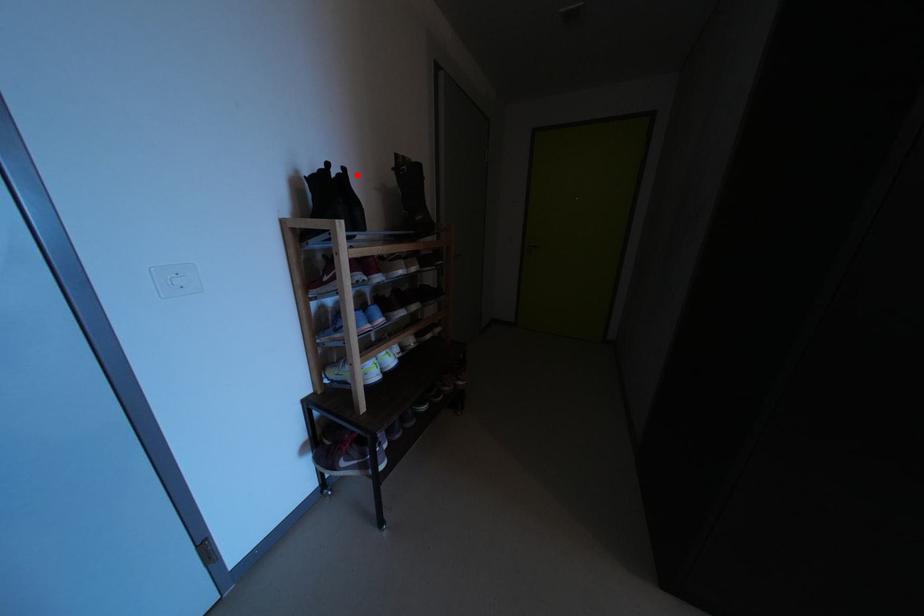
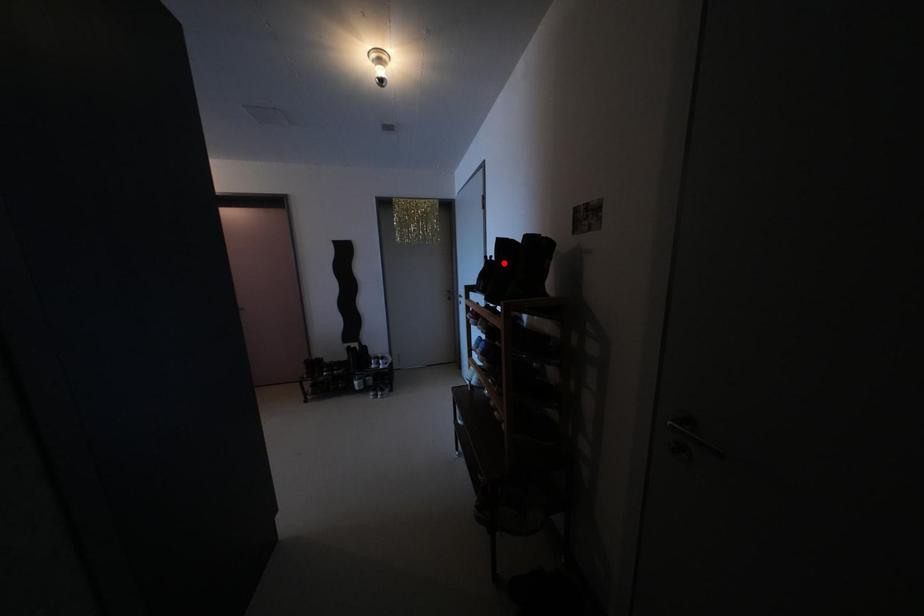
I am providing you with two images of the same scene from different viewpoints. A red point is marked on the first image and another point is marked on the second image. Are the points marked in image1 and image2 representing the same 3D position?

Yes